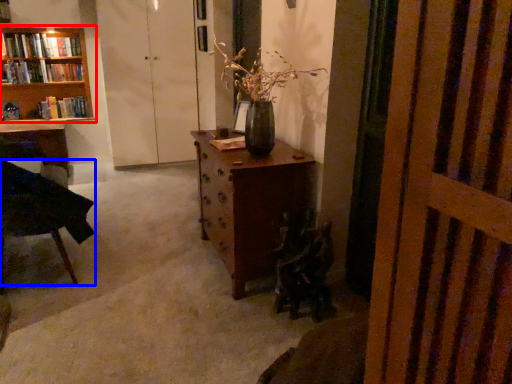
Question: Which object is closer to the camera taking this photo, bookcase (highlighted by a red box) or chair (highlighted by a blue box)?

Choices:
 (A) bookcase
 (B) chair

Answer: (B)